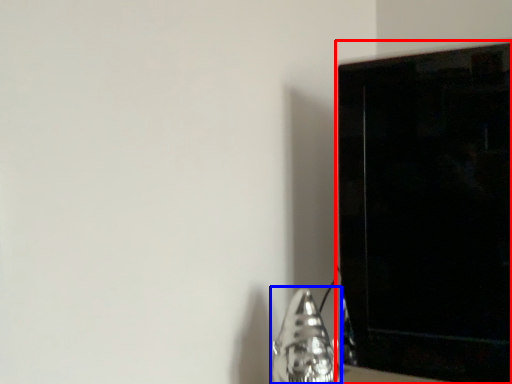
Question: Which object appears farthest to the camera in this image, furniture (highlighted by a red box) or silver (highlighted by a blue box)?

Choices:
 (A) furniture
 (B) silver

Answer: (A)